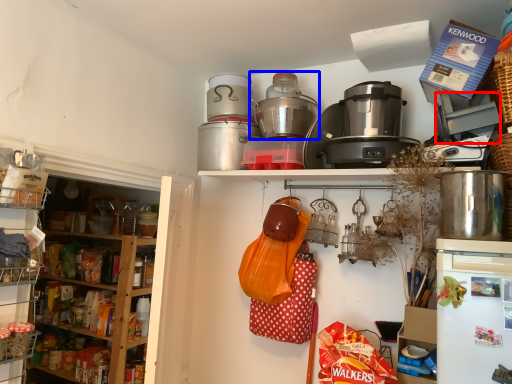
Question: Which of the following is the farthest to the observer, appliance (highlighted by a red box) or rice cooker (highlighted by a blue box)?

Choices:
 (A) appliance
 (B) rice cooker

Answer: (B)